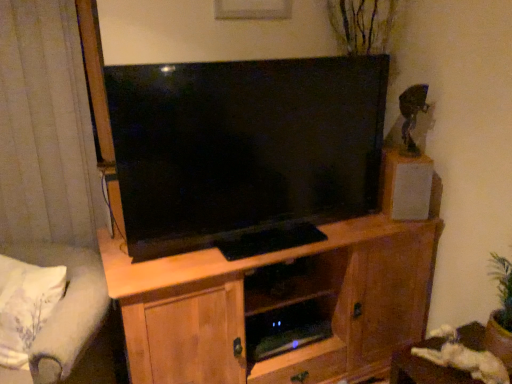
Question: From a real-world perspective, is light gray fabric studio couch at lower left on wooden table at lower right?

Choices:
 (A) no
 (B) yes

Answer: (B)

Question: From the image's perspective, is light gray fabric studio couch at lower left on top of wooden table at lower right?

Choices:
 (A) no
 (B) yes

Answer: (B)

Question: Is the surface of light gray fabric studio couch at lower left in direct contact with wooden table at lower right?

Choices:
 (A) no
 (B) yes

Answer: (A)

Question: Can wooden table at lower right be found inside light gray fabric studio couch at lower left?

Choices:
 (A) yes
 (B) no

Answer: (B)

Question: Can you confirm if light gray fabric studio couch at lower left is shorter than wooden table at lower right?

Choices:
 (A) no
 (B) yes

Answer: (A)

Question: From a real-world perspective, relative to wooden table at lower right, is gray fabric curtain at left vertically above or below?

Choices:
 (A) below
 (B) above

Answer: (B)

Question: From the image's perspective, is gray fabric curtain at left located above or below wooden table at lower right?

Choices:
 (A) above
 (B) below

Answer: (A)

Question: From their relative heights in the image, would you say gray fabric curtain at left is taller or shorter than wooden table at lower right?

Choices:
 (A) tall
 (B) short

Answer: (A)

Question: In the image, is gray fabric curtain at left positioned in front of or behind wooden table at lower right?

Choices:
 (A) behind
 (B) front

Answer: (A)

Question: From a real-world perspective, relative to light gray fabric studio couch at lower left, is light brown wood cabinet at center vertically above or below?

Choices:
 (A) below
 (B) above

Answer: (A)

Question: In terms of height, does light brown wood cabinet at center look taller or shorter compared to light gray fabric studio couch at lower left?

Choices:
 (A) tall
 (B) short

Answer: (A)

Question: Is light brown wood cabinet at center in front of or behind light gray fabric studio couch at lower left in the image?

Choices:
 (A) behind
 (B) front

Answer: (A)

Question: Is point tap(141, 281) closer or farther from the camera than point tap(75, 339)?

Choices:
 (A) closer
 (B) farther

Answer: (B)

Question: In terms of width, does wooden table at lower right look wider or thinner when compared to gray fabric curtain at left?

Choices:
 (A) wide
 (B) thin

Answer: (A)

Question: From a real-world perspective, relative to gray fabric curtain at left, is wooden table at lower right vertically above or below?

Choices:
 (A) below
 (B) above

Answer: (A)